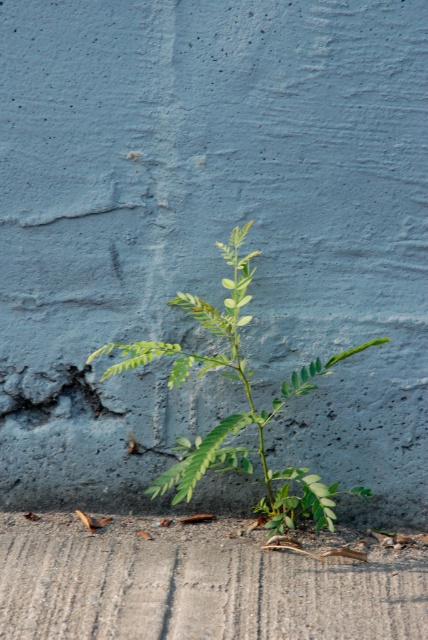
Question: Can you confirm if gray concrete at bottom is positioned below green leafy plant at center?

Choices:
 (A) yes
 (B) no

Answer: (A)

Question: Which point is farther from the camera taking this photo?

Choices:
 (A) (332, 513)
 (B) (368, 628)

Answer: (A)

Question: Which of the following is the closest to the observer?

Choices:
 (A) gray concrete at bottom
 (B) green leafy plant at center

Answer: (A)

Question: Can you confirm if gray concrete at bottom is wider than green leafy plant at center?

Choices:
 (A) no
 (B) yes

Answer: (B)

Question: Can you confirm if gray concrete at bottom is bigger than green leafy plant at center?

Choices:
 (A) yes
 (B) no

Answer: (B)